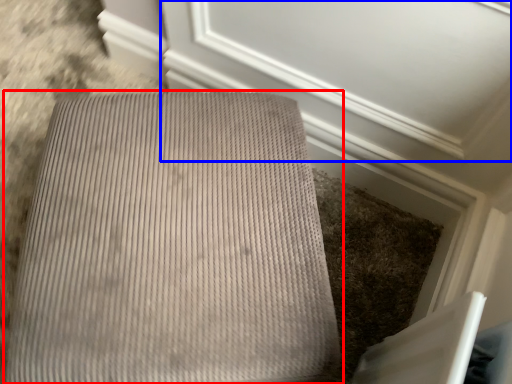
Question: Which object is closer to the camera taking this photo, furniture (highlighted by a red box) or screen door (highlighted by a blue box)?

Choices:
 (A) furniture
 (B) screen door

Answer: (A)